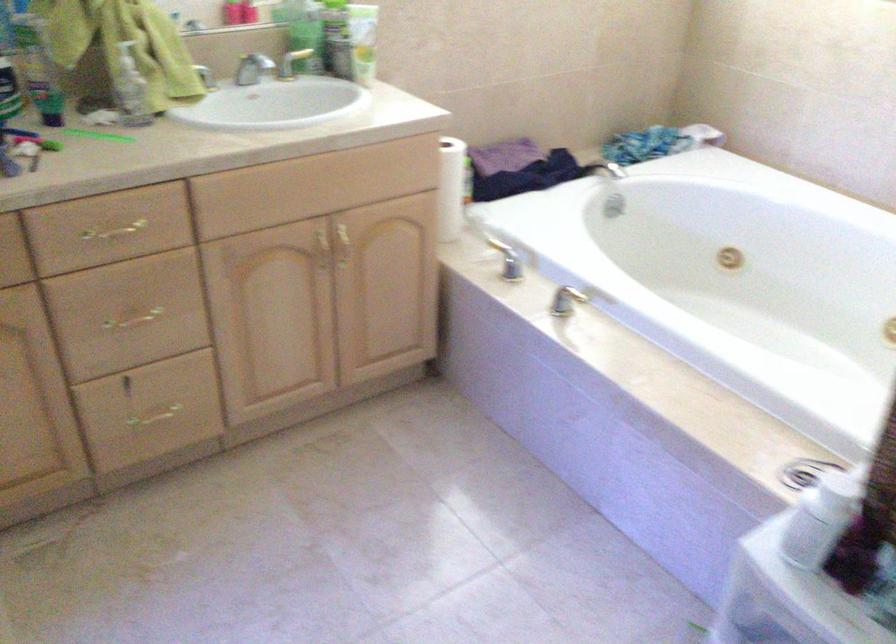
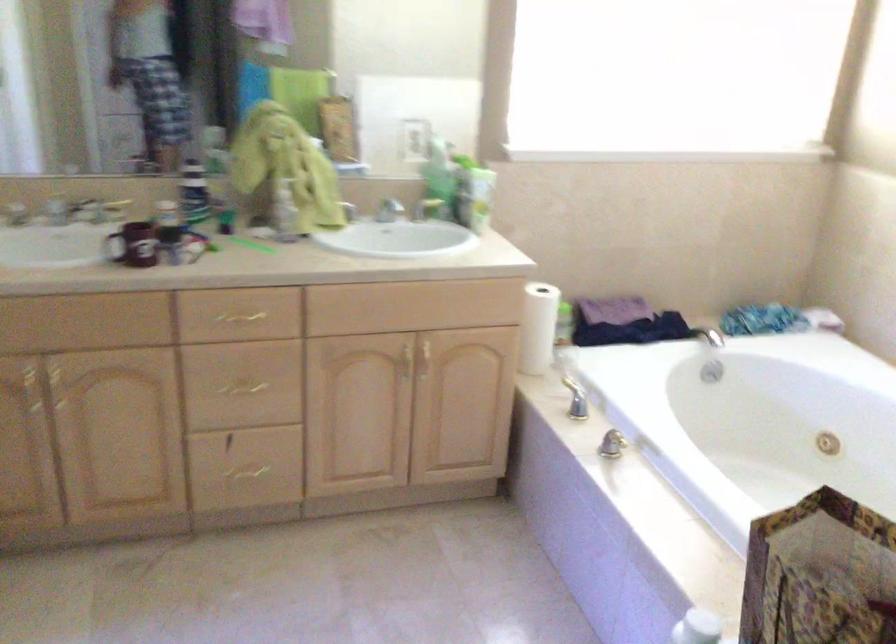
In the second image, find the point that corresponds to the point at 449,190 in the first image.

(538, 327)